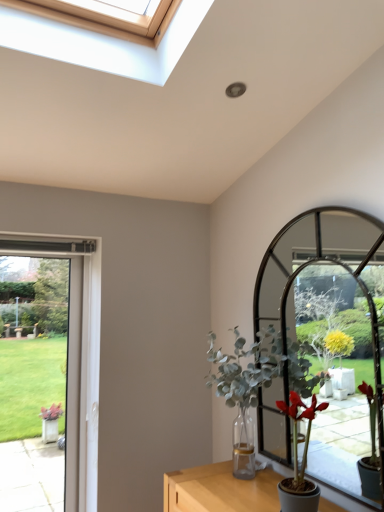
Question: From the image's perspective, is clear glass door at left on top of matte green plant at right, placed as the first houseplant when sorted from front to back?

Choices:
 (A) no
 (B) yes

Answer: (B)

Question: From the image's perspective, does clear glass door at left appear lower than matte green plant at right, placed as the first houseplant when sorted from front to back?

Choices:
 (A) no
 (B) yes

Answer: (A)

Question: Would you say matte green plant at right, placed as the first houseplant when sorted from front to back, is part of clear glass door at left's contents?

Choices:
 (A) yes
 (B) no

Answer: (B)

Question: Considering the relative sizes of clear glass door at left and matte green plant at right, the 2th houseplant when ordered from back to front, in the image provided, is clear glass door at left bigger than matte green plant at right, the 2th houseplant when ordered from back to front,?

Choices:
 (A) yes
 (B) no

Answer: (A)

Question: Can you confirm if clear glass door at left is wider than matte green plant at right, placed as the first houseplant when sorted from front to back?

Choices:
 (A) yes
 (B) no

Answer: (B)

Question: From a real-world perspective, relative to clear glass door at left, is green leafy plant at center, the 1th houseplant viewed from the back, vertically above or below?

Choices:
 (A) below
 (B) above

Answer: (B)

Question: In terms of height, does green leafy plant at center, the second houseplant when ordered from front to back, look taller or shorter compared to clear glass door at left?

Choices:
 (A) short
 (B) tall

Answer: (A)

Question: Is green leafy plant at center, the 1th houseplant viewed from the back, bigger or smaller than clear glass door at left?

Choices:
 (A) small
 (B) big

Answer: (B)

Question: Is green leafy plant at center, the 1th houseplant viewed from the back, wider or thinner than clear glass door at left?

Choices:
 (A) thin
 (B) wide

Answer: (B)

Question: Which is correct: clear glass door at left is inside green leafy plant at center, the second houseplant when ordered from front to back, or outside of it?

Choices:
 (A) inside
 (B) outside

Answer: (B)

Question: From their relative heights in the image, would you say clear glass door at left is taller or shorter than green leafy plant at center, the 1th houseplant viewed from the back?

Choices:
 (A) short
 (B) tall

Answer: (B)

Question: From a real-world perspective, relative to green leafy plant at center, the 1th houseplant viewed from the back, is clear glass door at left vertically above or below?

Choices:
 (A) below
 (B) above

Answer: (A)

Question: Would you say clear glass door at left is to the left or to the right of green leafy plant at center, the second houseplant when ordered from front to back, in the picture?

Choices:
 (A) right
 (B) left

Answer: (B)

Question: Looking at their shapes, would you say matte green plant at right, placed as the first houseplant when sorted from front to back, is wider or thinner than green leafy plant at center, the second houseplant when ordered from front to back?

Choices:
 (A) thin
 (B) wide

Answer: (A)

Question: Is point (317, 499) closer or farther from the camera than point (261, 347)?

Choices:
 (A) closer
 (B) farther

Answer: (A)